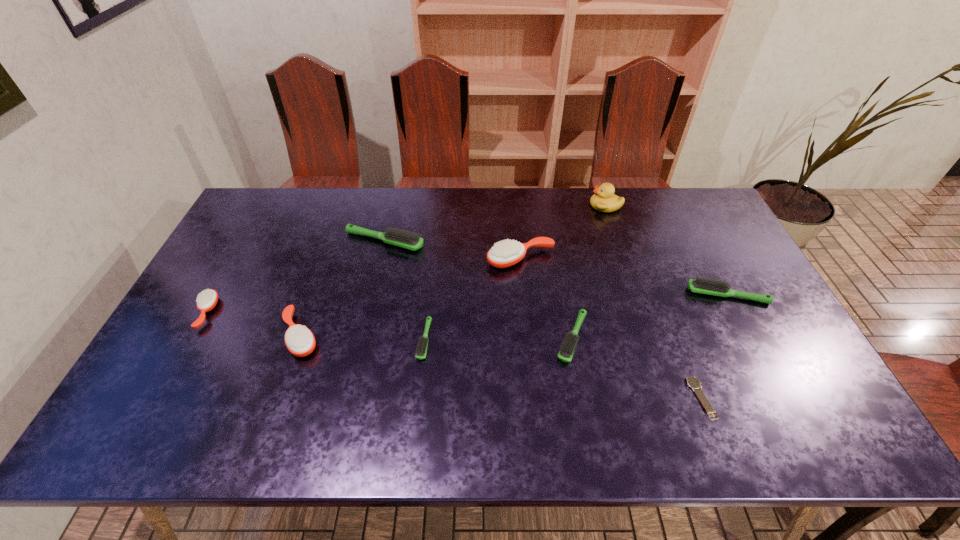
At what (x,y) coordinates should I click in order to perform the action: click on unoccupied position between the leftmost light hairbrush and the watch. Please return your answer as a coordinate pair (x, y). Looking at the image, I should click on (542, 320).

You are a GUI agent. You are given a task and a screenshot of the screen. Output one action in this format:
    pyautogui.click(x=<x>, y=<y>)
    Task: Click on the free space between the second light hairbrush from right to left and the third nearest light hairbrush
    Image resolution: width=960 pixels, height=540 pixels.
    Given the screenshot: What is the action you would take?
    pyautogui.click(x=650, y=316)

Where is `free spot between the shortest object and the second orange hairbrush from left to right`? free spot between the shortest object and the second orange hairbrush from left to right is located at coordinates (501, 367).

This screenshot has width=960, height=540. I want to click on free space between the shortest object and the leftmost orange hairbrush, so click(453, 355).

What are the coordinates of `vacant area between the leftmost light hairbrush and the duckling` in the screenshot? It's located at (495, 223).

You are a GUI agent. You are given a task and a screenshot of the screen. Output one action in this format:
    pyautogui.click(x=<x>, y=<y>)
    Task: Click on the vacant region between the leftmost orange hairbrush and the shortest object
    
    Given the screenshot: What is the action you would take?
    pos(453,355)

Where is `vacant area that lies between the second shortest hairbrush and the watch`? The height and width of the screenshot is (540, 960). vacant area that lies between the second shortest hairbrush and the watch is located at coordinates (636, 368).

You are a GUI agent. You are given a task and a screenshot of the screen. Output one action in this format:
    pyautogui.click(x=<x>, y=<y>)
    Task: Click on the empty space between the second light hairbrush from right to left and the rightmost orange hairbrush
    
    Given the screenshot: What is the action you would take?
    pyautogui.click(x=546, y=298)

Identify the location of blank region between the tallest object and the rightmost hairbrush. (666, 250).

Select which object is the eighth closest to the leftmost orange hairbrush. Please provide its 2D coordinates. Your answer should be formatted as a tuple, i.e. [(x, y)], where the tuple contains the x and y coordinates of a point satisfying the conditions above.

[(701, 285)]